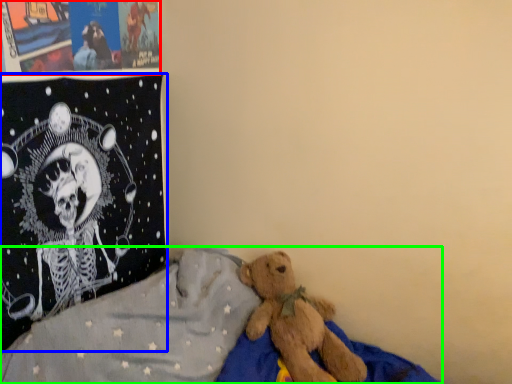
Question: Which object is positioned closest to poster page (highlighted by a red box)? Select from pillow (highlighted by a blue box) and bed (highlighted by a green box).

Choices:
 (A) pillow
 (B) bed

Answer: (A)